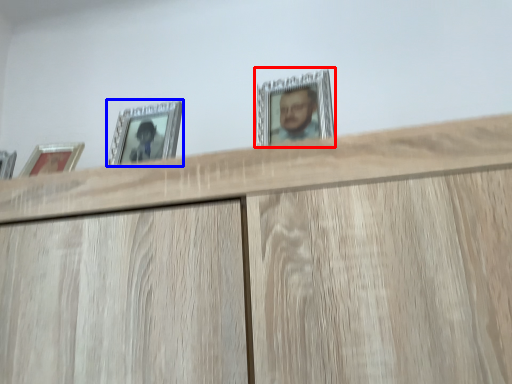
Question: Which object appears closest to the camera in this image, picture frame (highlighted by a red box) or picture frame (highlighted by a blue box)?

Choices:
 (A) picture frame
 (B) picture frame

Answer: (A)